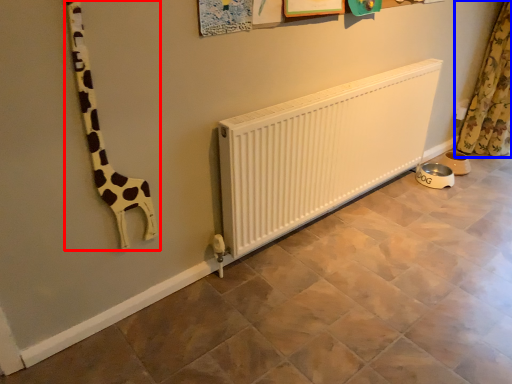
Question: Which object appears farthest to the camera in this image, giraffe (highlighted by a red box) or curtain (highlighted by a blue box)?

Choices:
 (A) giraffe
 (B) curtain

Answer: (B)